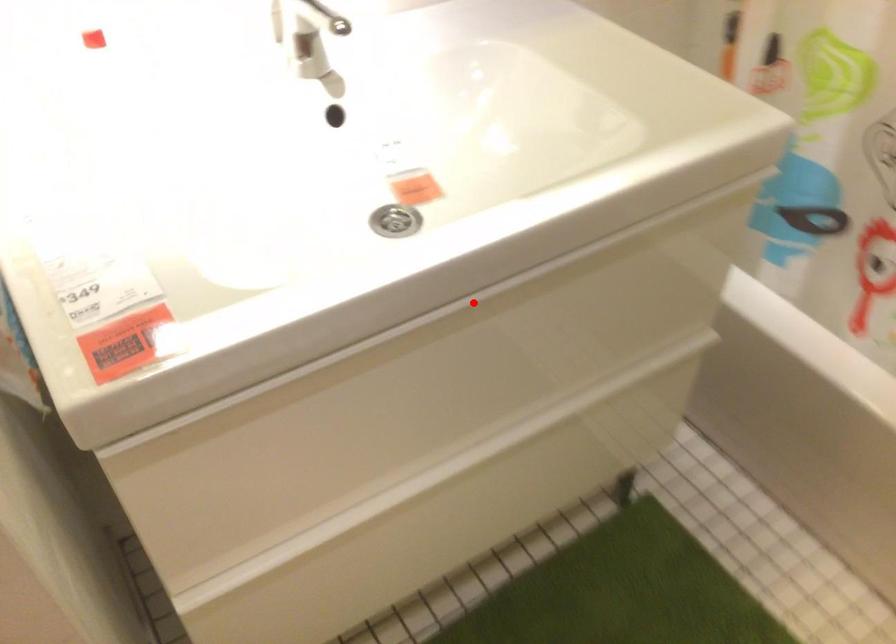
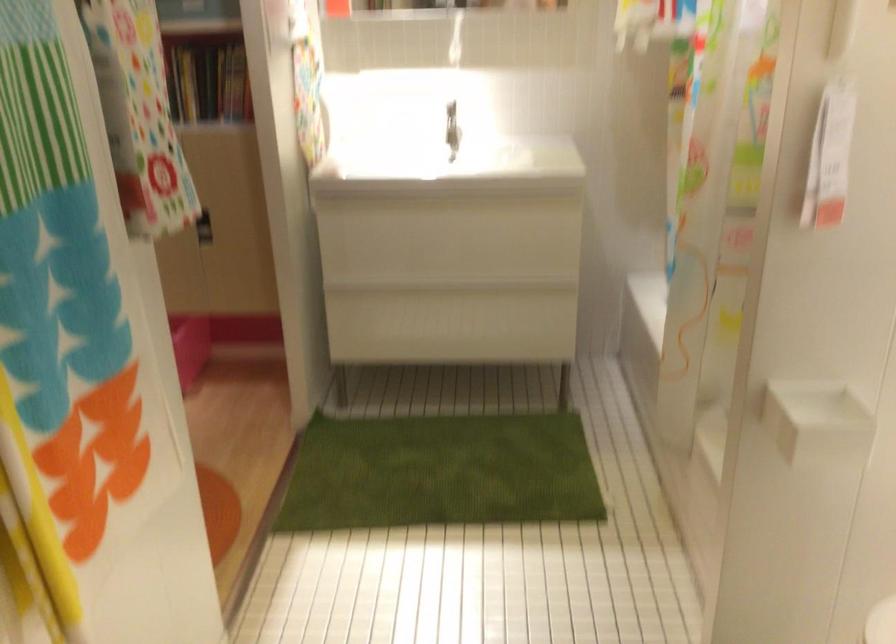
Find the pixel in the second image that matches the highlighted location in the first image.

(440, 201)